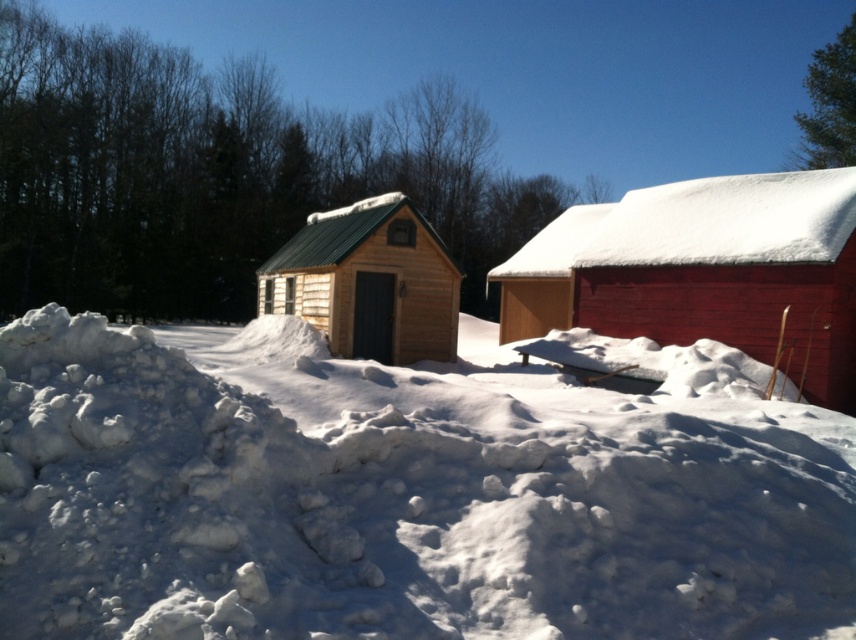
Question: Can you confirm if white fluffy snow at center is positioned to the right of natural wood cabin at center?

Choices:
 (A) no
 (B) yes

Answer: (B)

Question: Which of the following is the farthest from the observer?

Choices:
 (A) (265, 266)
 (B) (716, 276)
 (C) (595, 481)

Answer: (A)

Question: Does white fluffy snow at center have a smaller size compared to natural wood cabin at center?

Choices:
 (A) yes
 (B) no

Answer: (B)

Question: Which point appears closest to the camera in this image?

Choices:
 (A) (340, 352)
 (B) (366, 472)

Answer: (B)

Question: Which of the following is the farthest from the observer?

Choices:
 (A) smooth red barn at right
 (B) white fluffy snow at center
 (C) natural wood cabin at center

Answer: (C)

Question: Does white fluffy snow at center have a lesser width compared to smooth red barn at right?

Choices:
 (A) no
 (B) yes

Answer: (A)